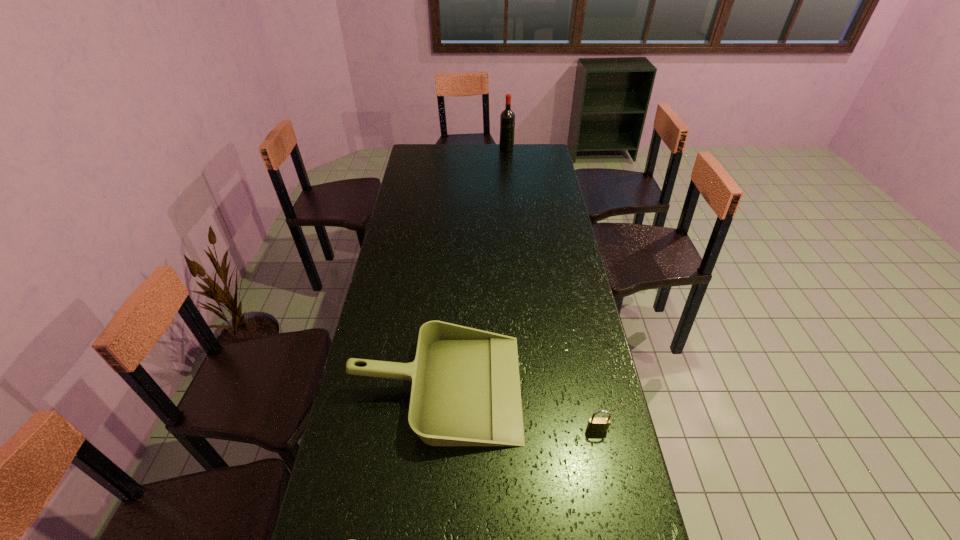
I want to click on the farthest object, so click(x=507, y=118).

Where is `the tallest object`? the tallest object is located at coordinates (507, 118).

The height and width of the screenshot is (540, 960). I want to click on dustpan, so click(x=465, y=391).

This screenshot has width=960, height=540. Identify the location of the shortest object. (594, 424).

Where is `the rightmost object`? This screenshot has height=540, width=960. the rightmost object is located at coordinates (594, 424).

Identify the location of blank space located on the left of the farthest object. (445, 150).

Locate an element on the screen. This screenshot has width=960, height=540. vacant space situated 0.140m on the scoop of the second shortest object is located at coordinates [566, 387].

Identify the location of free point located on the front-facing side of the rightmost object. (618, 531).

Image resolution: width=960 pixels, height=540 pixels. Identify the location of object situated at the far edge. click(x=507, y=118).

Locate an element on the screen. The image size is (960, 540). object present at the left edge is located at coordinates (465, 391).